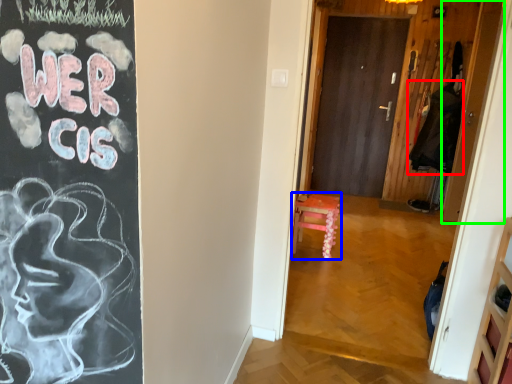
Question: Which object is the closest to the garment (highlighted by a red box)? Choose among these: furniture (highlighted by a blue box) or door (highlighted by a green box).

Choices:
 (A) furniture
 (B) door

Answer: (B)